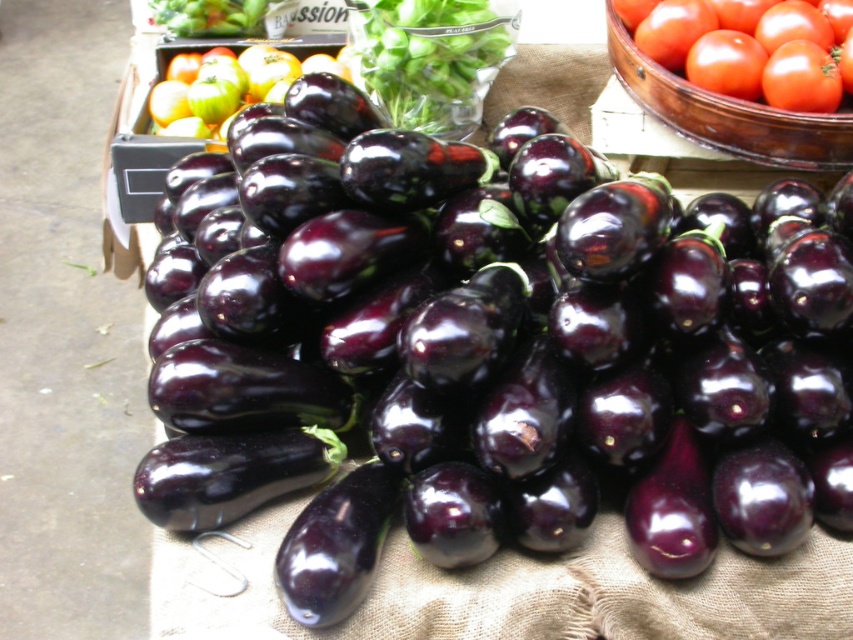
Find the location of `shiny purple eggplant at center`. shiny purple eggplant at center is located at coordinates (496, 352).

Who is positioned more to the left, shiny purple eggplant at center or shiny green apples at upper left?

From the viewer's perspective, shiny green apples at upper left appears more on the left side.

The height and width of the screenshot is (640, 853). I want to click on shiny purple eggplant at center, so click(496, 352).

Find the location of a particular element. shiny purple eggplant at center is located at coordinates (496, 352).

Is point (851, 35) behind point (250, 88)?

That is False.

Which is in front, point (747, 0) or point (285, 52)?

Point (747, 0)

Who is more distant from viewer, (685,29) or (277,97)?

The point (277,97) is behind.

Identify the location of glossy red tomato at upper right. This screenshot has height=640, width=853. (744, 49).

Is shiny purple eggplant at center to the right of glossy red tomato at upper right from the viewer's perspective?

In fact, shiny purple eggplant at center is to the left of glossy red tomato at upper right.

In order to click on shiny purple eggplant at center in this screenshot , I will do `click(496, 352)`.